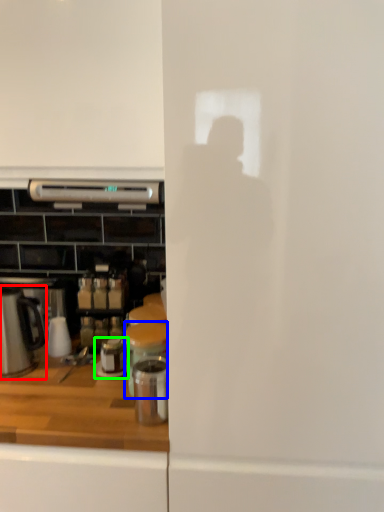
Question: Which object is the closest to the kitchen appliance (highlighted by a red box)? Choose among these: appliance (highlighted by a blue box) or appliance (highlighted by a green box).

Choices:
 (A) appliance
 (B) appliance

Answer: (B)